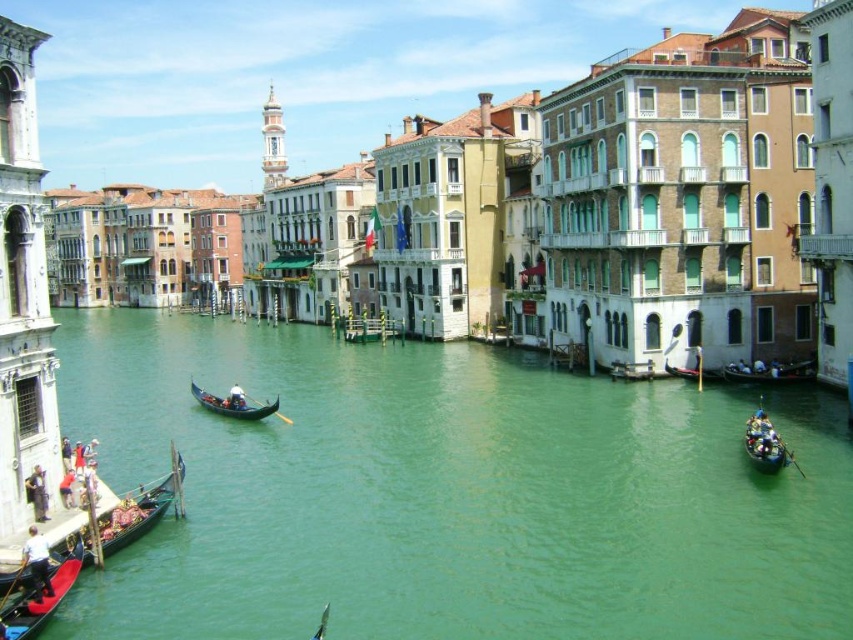
How far apart are wooden gondola at lower left and black polished wood gondola at center?

wooden gondola at lower left and black polished wood gondola at center are 58.02 feet apart from each other.

Is wooden gondola at lower left further to the viewer compared to black polished wood gondola at center?

No, it is in front of black polished wood gondola at center.

Between point (169, 500) and point (193, 381), which one is positioned in front?

Point (169, 500)

I want to click on wooden gondola at lower left, so click(x=141, y=509).

Who is positioned more to the left, green water at center or black polished wood gondola at lower left?

Positioned to the left is black polished wood gondola at lower left.

Does point (514, 394) lie in front of point (71, 586)?

No, it is not.

Who is more distant from viewer, (186, 561) or (38, 598)?

Point (186, 561)

In order to click on green water at center in this screenshot , I will do `click(447, 493)`.

Who is lower down, green water at center or wooden gondola at lower left?

wooden gondola at lower left is lower down.

Does point (247, 346) lie in front of point (167, 486)?

No.

In the scene shown: Who is more distant from viewer, (71, 600) or (115, 525)?

Point (115, 525)

Where is `green water at center`? This screenshot has width=853, height=640. green water at center is located at coordinates (447, 493).